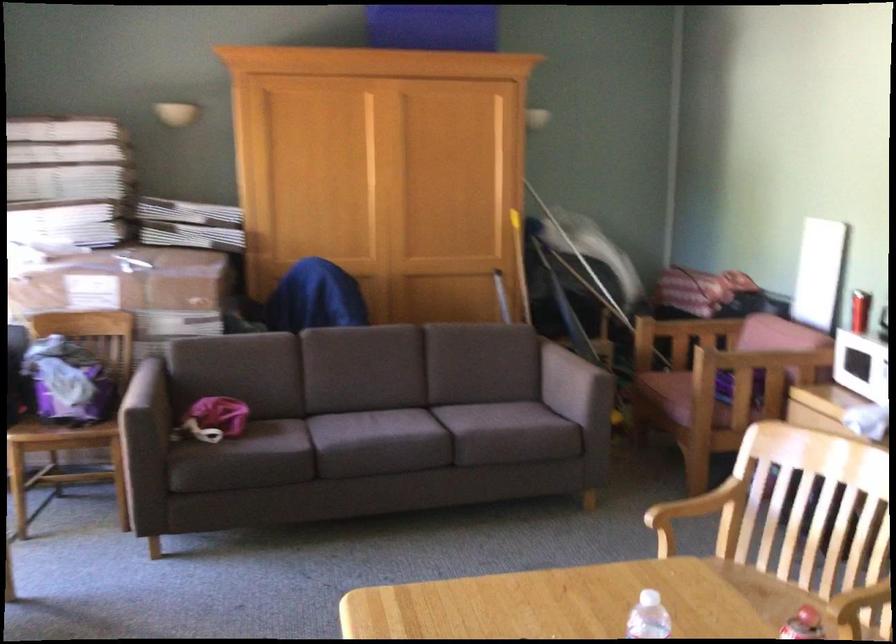
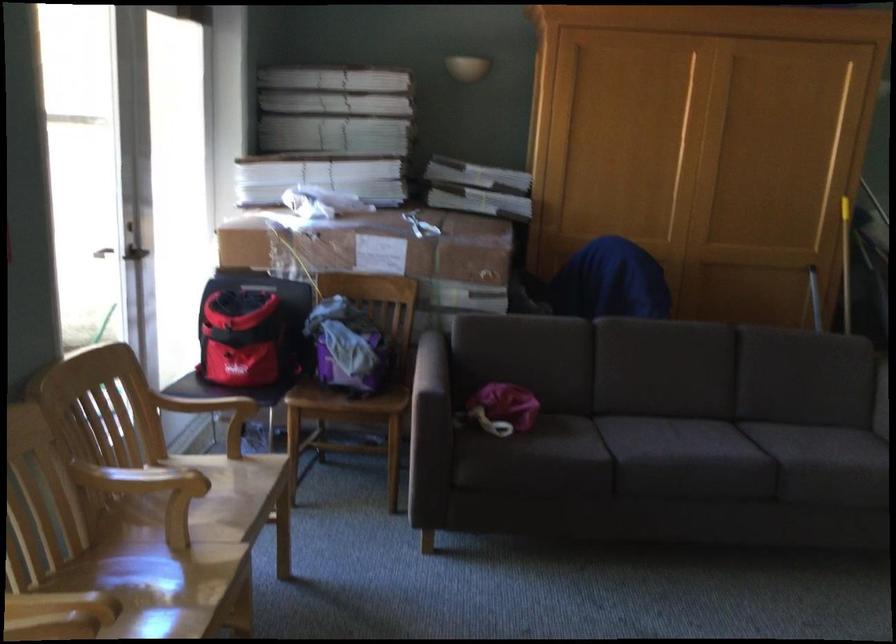
Locate, in the second image, the point that corresponds to the point at 213,420 in the first image.

(503, 408)